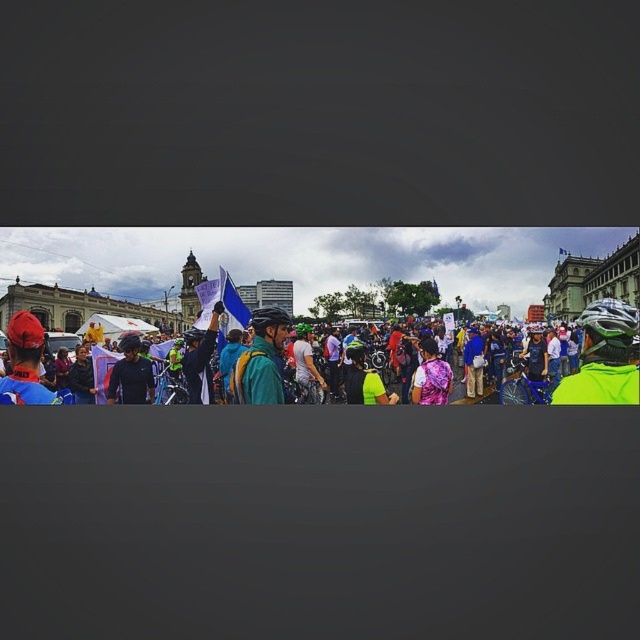
You are a photographer trying to capture a photo of the neon yellow jacket at center and the matte black helmet at center. Which object should you focus on first if you want to ensure both are in the frame without moving the camera?

The neon yellow jacket at center is located below the matte black helmet at center, so you should focus on the matte black helmet at center first to ensure both are in the frame without moving the camera.

You are a photographer standing at the edge of a crowd, trying to capture a photo of both the neon yellow jacket at center and the matte black helmet at center in the same frame. Your camera has a maximum zoom range that can cover 20 meters. Will you be able to fit both objects into the frame without moving closer?

The neon yellow jacket at center and matte black helmet at center are 20.78 meters apart from each other. Since the camera can only cover 20 meters, the distance between them exceeds the maximum zoom range. Therefore, you cannot fit both objects into the frame without moving closer.